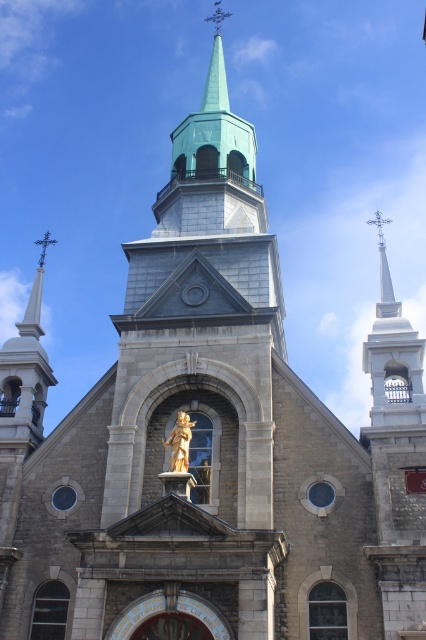
You are standing at a viewpoint where you can see both point A at point (379, 253) and point B at point (178, 429). According to the image, which point is closer to you?

Point B at point (178, 429) is closer to you because point A at point (379, 253) is behind it.

You are standing in front of the church and want to determine the relative positions of two points marked on the building. The first point is located at coordinates point (382, 264) and the second at point (195, 420). Which point is closer to you?

Point (382, 264) is further to the viewer than point (195, 420). Therefore, point (195, 420) is closer to you.

You are an architect evaluating the church design. You notice the white stone steeple at upper right and the polished silver spire at upper right. Which of these two structures is taller?

The white stone steeple at upper right is taller than the polished silver spire at upper right according to the description provided.